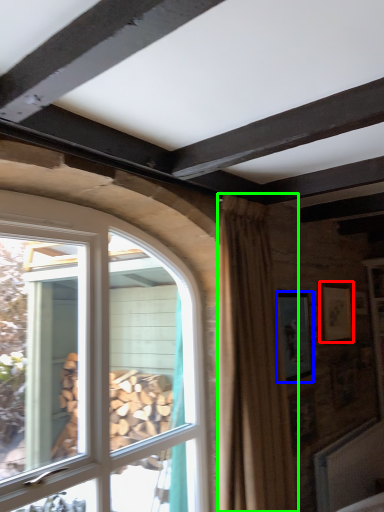
Question: Estimate the real-world distances between objects in this image. Which object is farther from picture frame (highlighted by a red box), picture frame (highlighted by a blue box) or curtain (highlighted by a green box)?

Choices:
 (A) picture frame
 (B) curtain

Answer: (B)